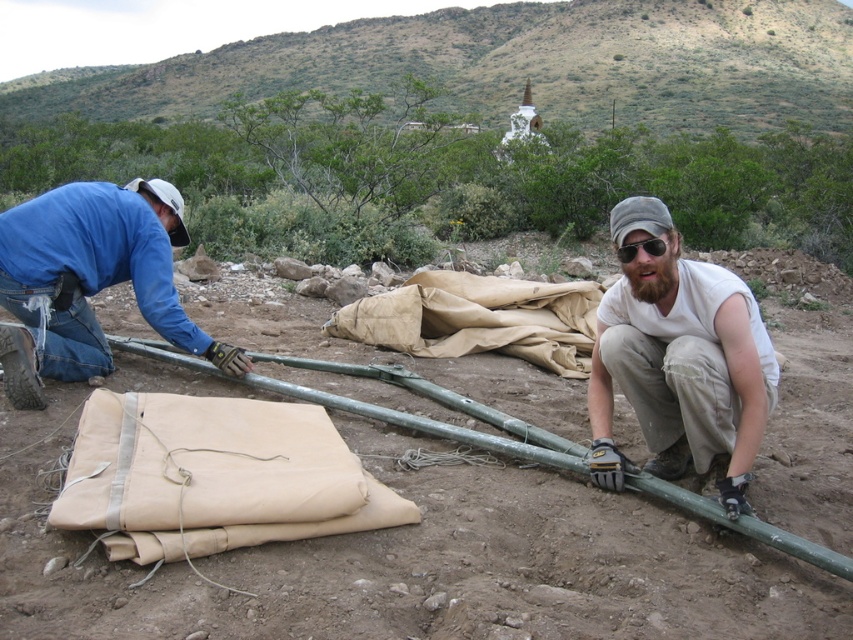
Describe the element at coordinates (677, 358) in the screenshot. I see `white cotton shirt at center` at that location.

Is white cotton shirt at center wider than blue denim jeans at left?

In fact, white cotton shirt at center might be narrower than blue denim jeans at left.

Who is more distant from viewer, (688, 300) or (102, 237)?

Point (102, 237)

Locate an element on the screen. Image resolution: width=853 pixels, height=640 pixels. white cotton shirt at center is located at coordinates click(x=677, y=358).